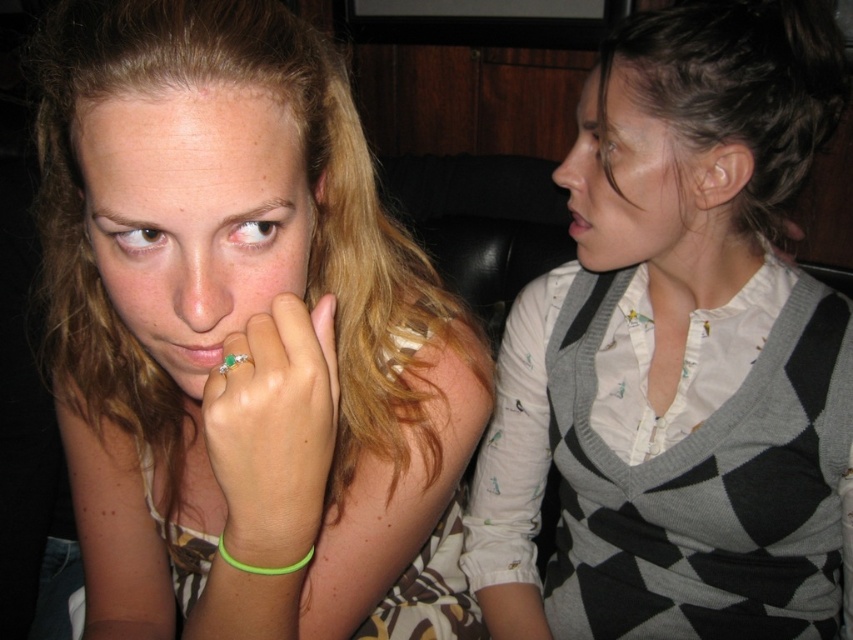
Question: Which object appears closest to the camera in this image?

Choices:
 (A) dark brown hair at upper right
 (B) white textured shirt at upper right
 (C) gold ring at center
 (D) matte gold ring at center

Answer: (D)

Question: From the image, what is the correct spatial relationship of matte gold ring at center in relation to green rubber band at lower center?

Choices:
 (A) below
 (B) above

Answer: (B)

Question: Considering the real-world distances, which object is closest to the white textured shirt at upper right?

Choices:
 (A) gold ring at center
 (B) matte gray hair at upper right
 (C) matte gold ring at center
 (D) smooth skin face at upper right

Answer: (D)

Question: Is matte brown hair at left to the right of white textured shirt at upper right from the viewer's perspective?

Choices:
 (A) yes
 (B) no

Answer: (B)

Question: Which point is closer to the camera?

Choices:
 (A) smooth skin face at upper right
 (B) white textured shirt at upper right

Answer: (B)

Question: Is matte brown hair at left below green rubber band at lower center?

Choices:
 (A) yes
 (B) no

Answer: (B)